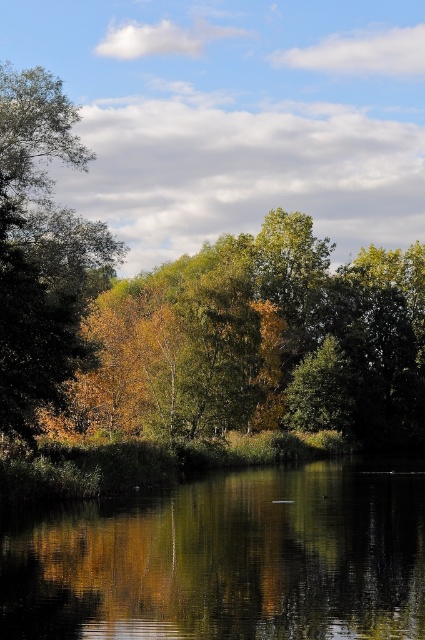
You are a GUI agent. You are given a task and a screenshot of the screen. Output one action in this format:
    pyautogui.click(x=<x>, y=<y>)
    Task: Click on the golden leaves at center
    This screenshot has height=640, width=425.
    Given the screenshot: What is the action you would take?
    pyautogui.click(x=192, y=314)

Find the location of a particular element. golden leaves at center is located at coordinates (192, 314).

Between green reflective water at center and golden yellow leaves at left, which one is positioned lower?

Positioned lower is green reflective water at center.

Is green reflective water at center positioned behind golden yellow leaves at left?

No, green reflective water at center is closer to the viewer.

The height and width of the screenshot is (640, 425). I want to click on green reflective water at center, so click(x=227, y=560).

Where is `golden leaves at center`? The height and width of the screenshot is (640, 425). golden leaves at center is located at coordinates (192, 314).

Describe the element at coordinates (192, 314) in the screenshot. I see `golden leaves at center` at that location.

Who is more forward, [3,364] or [189,625]?

Point [189,625] is more forward.

Image resolution: width=425 pixels, height=640 pixels. I want to click on golden leaves at center, so click(x=192, y=314).